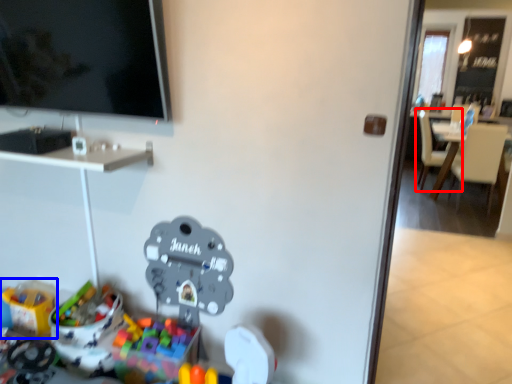
Question: Which object appears farthest to the camera in this image, chair (highlighted by a red box) or toy (highlighted by a blue box)?

Choices:
 (A) chair
 (B) toy

Answer: (A)